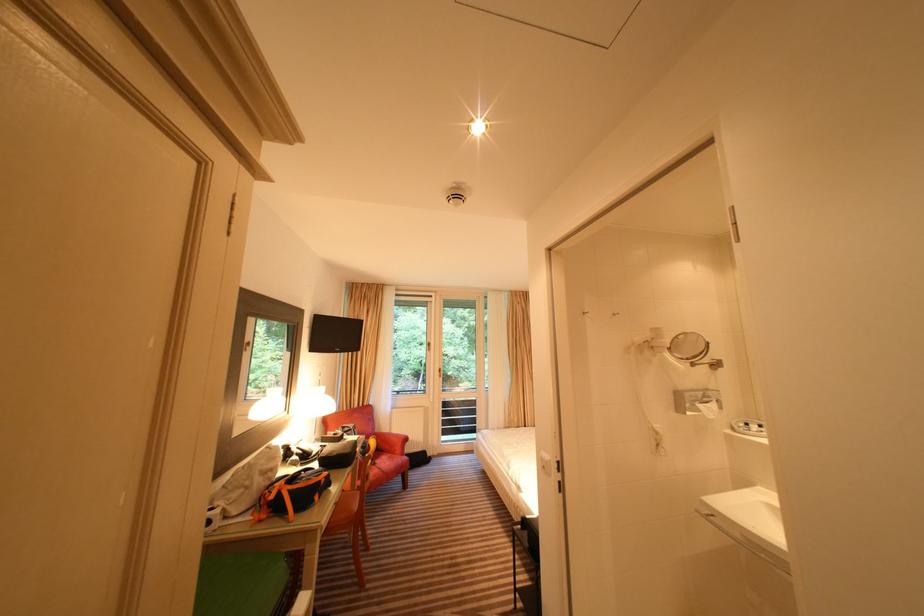
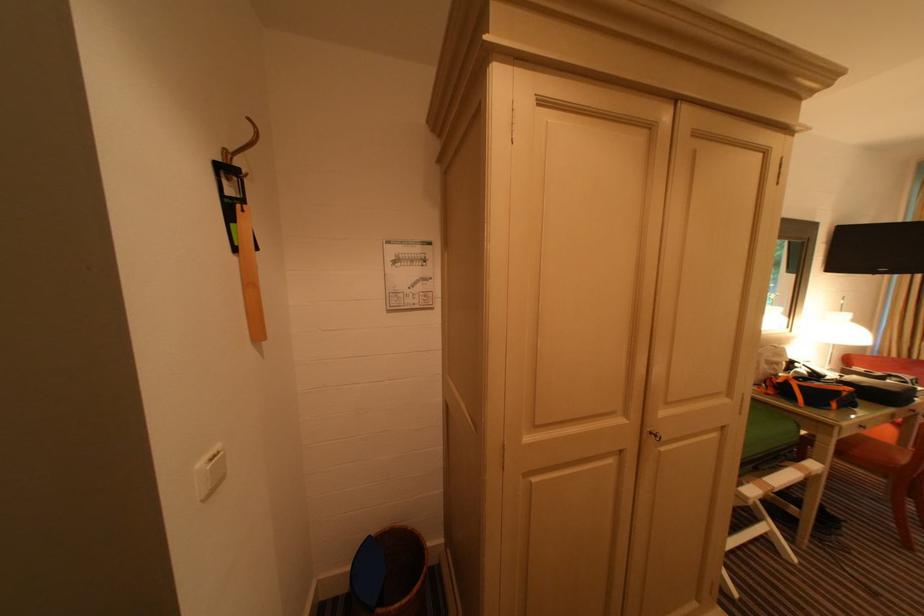
Question: The camera is either moving clockwise (left) or counter-clockwise (right) around the object. The first image is from the beginning of the video and the second image is from the end. Is the camera moving left or right when shooting the video?

Choices:
 (A) Left
 (B) Right

Answer: (B)